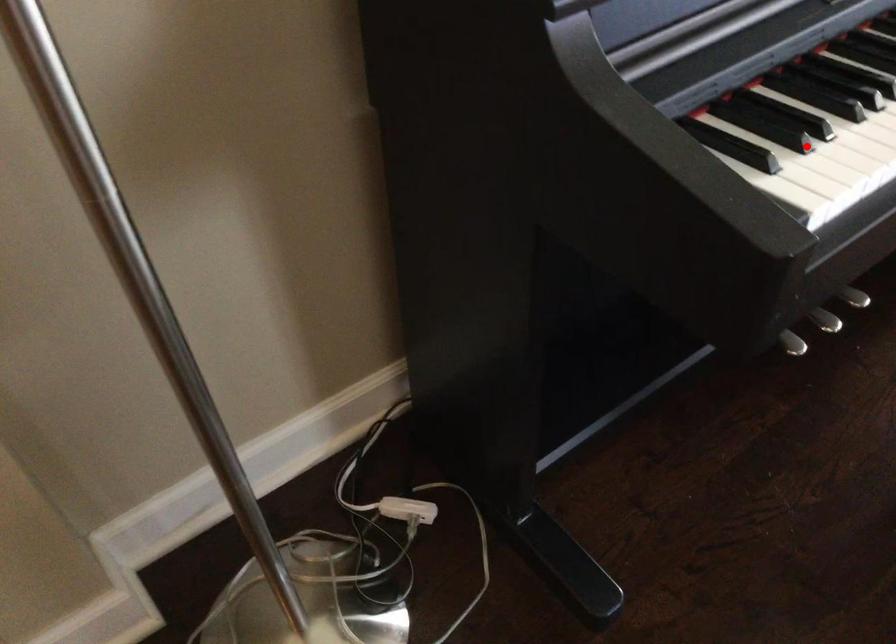
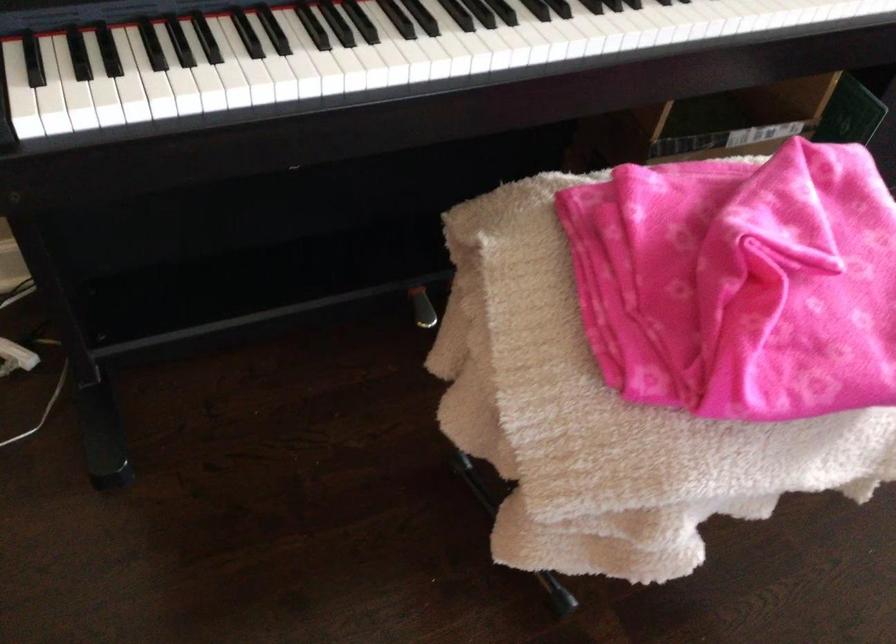
Locate, in the second image, the point that corresponds to the highlighted location in the first image.

(87, 80)